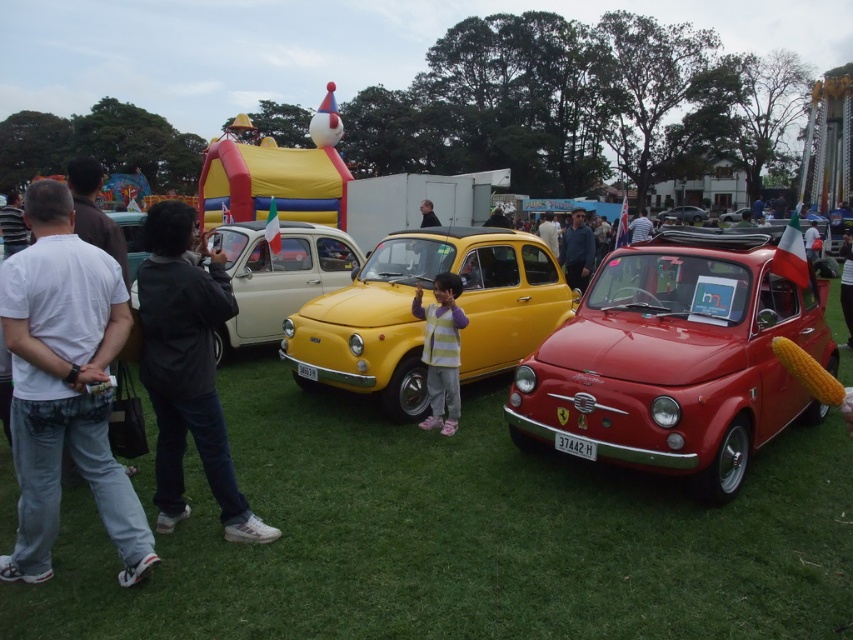
Which is above, white fabric bag at lower center or metallic silver car at center?

Positioned higher is metallic silver car at center.

Is the position of white fabric bag at lower center less distant than that of metallic silver car at center?

Yes.

This screenshot has height=640, width=853. I want to click on white fabric bag at lower center, so click(846, 284).

Which of these two, striped fabric dress at center or blue denim jeans at center, stands taller?

Standing taller between the two is blue denim jeans at center.

Does striped fabric dress at center lie behind blue denim jeans at center?

That is False.

Is point (444, 340) behind point (583, 227)?

No, (444, 340) is in front of (583, 227).

Image resolution: width=853 pixels, height=640 pixels. What are the coordinates of `striped fabric dress at center` in the screenshot? It's located at (440, 349).

Can you confirm if white cotton shirt at left is taller than white fabric bag at lower center?

No, white cotton shirt at left is not taller than white fabric bag at lower center.

Does white cotton shirt at left lie in front of white fabric bag at lower center?

Yes, white cotton shirt at left is in front of white fabric bag at lower center.

Find the location of a particular element. This screenshot has width=853, height=640. white cotton shirt at left is located at coordinates (65, 385).

Find the location of a particular element. The width and height of the screenshot is (853, 640). white cotton shirt at left is located at coordinates (65, 385).